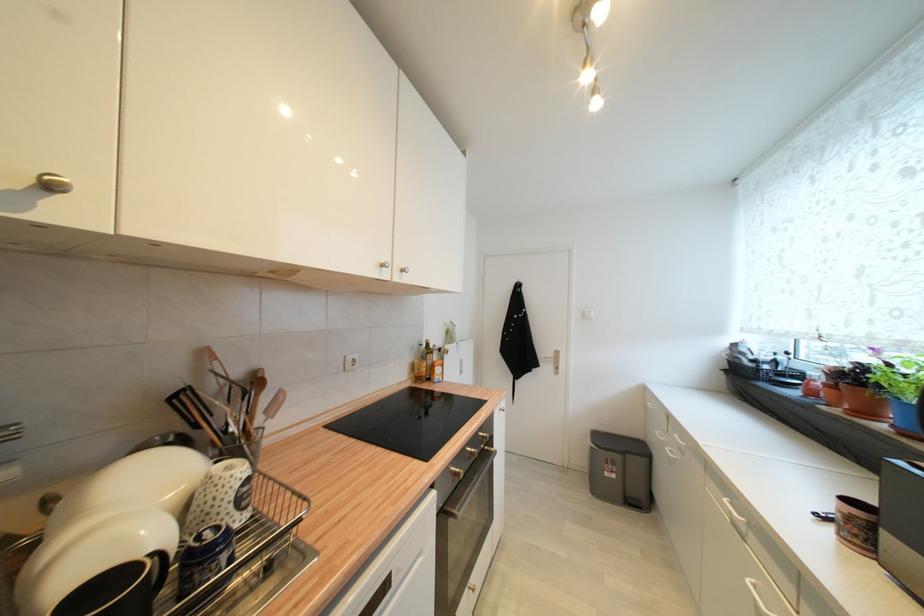
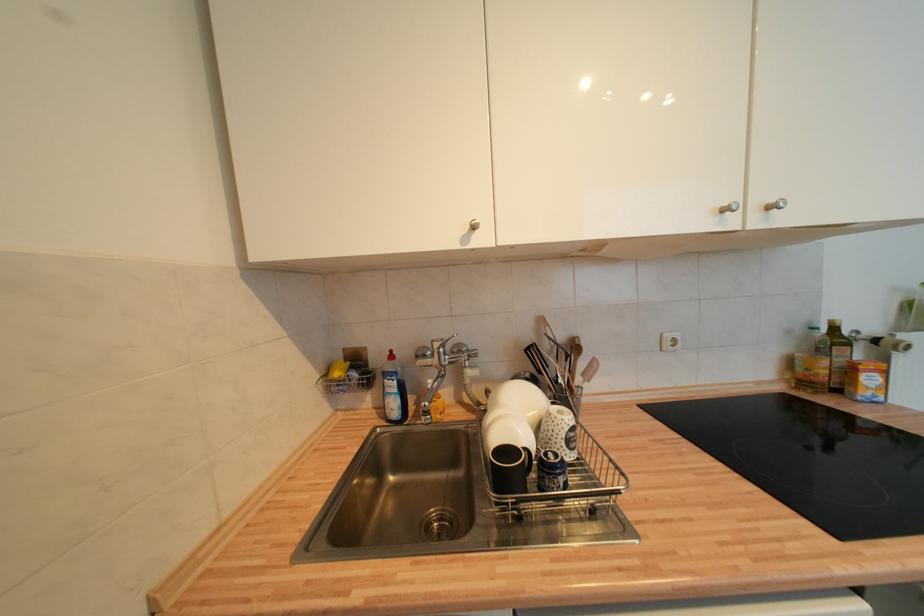
Locate, in the second image, the point that corresponds to (271,414) in the first image.

(588, 377)